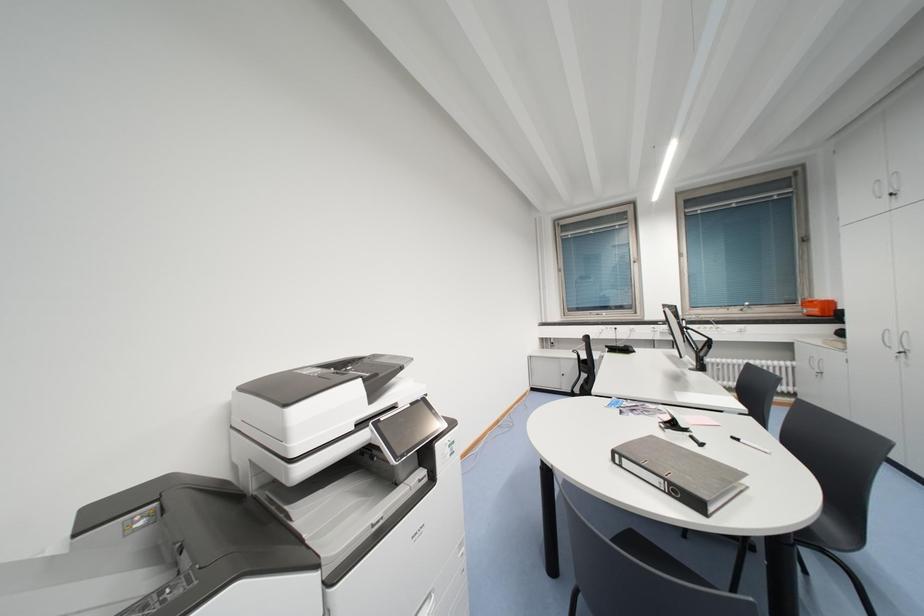
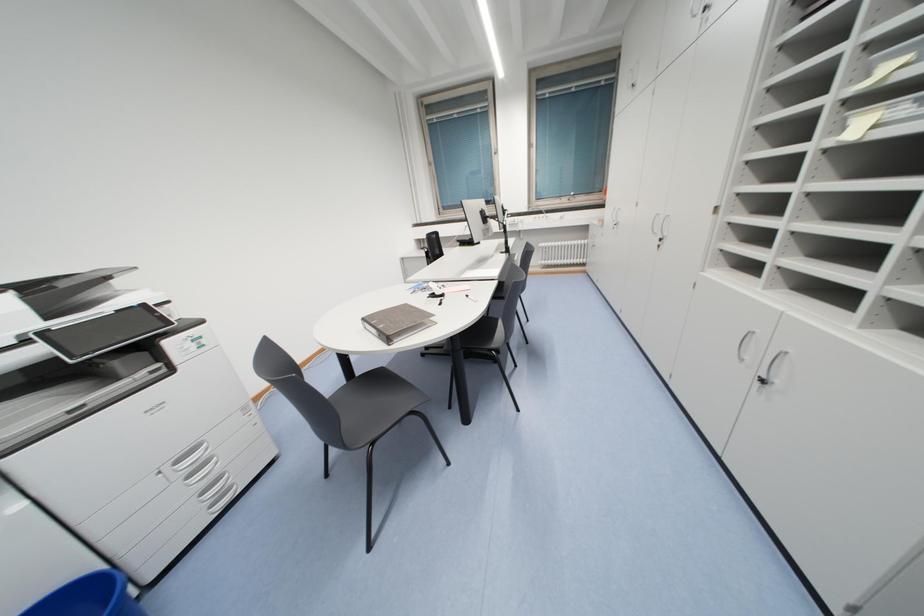
How did the camera likely rotate?

The camera rotated toward right-down.